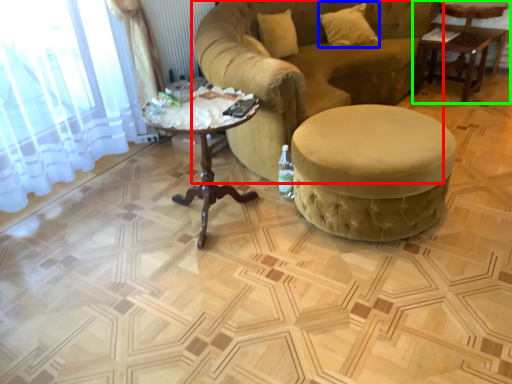
Question: Which object is the closest to the studio couch (highlighted by a red box)? Choose among these: pillow (highlighted by a blue box) or table (highlighted by a green box).

Choices:
 (A) pillow
 (B) table

Answer: (A)